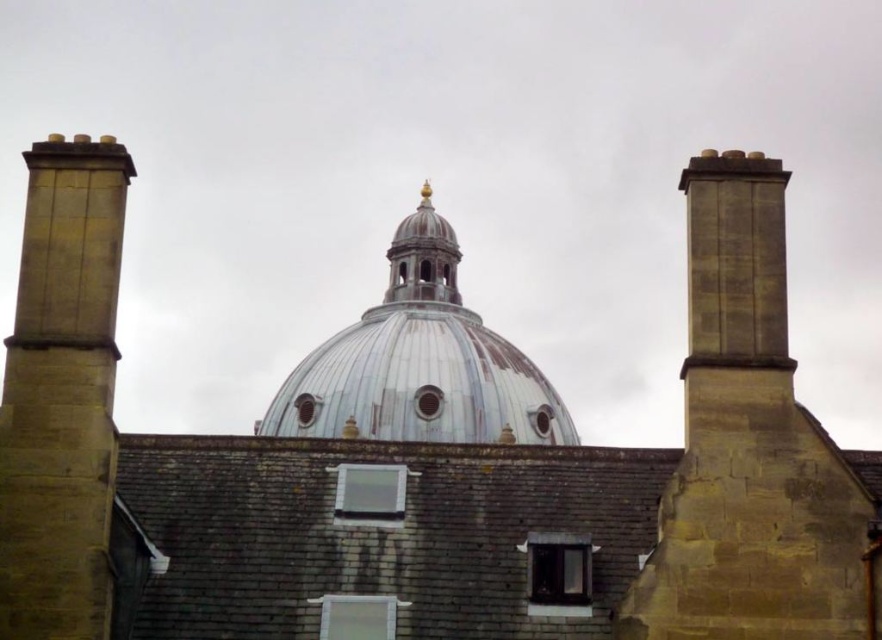
Question: Is brown stone chimney at left to the left of metallic silver dome at center from the viewer's perspective?

Choices:
 (A) yes
 (B) no

Answer: (A)

Question: Does brown stone chimney at left appear on the right side of metallic silver dome at center?

Choices:
 (A) yes
 (B) no

Answer: (B)

Question: Does brown stone chimney at left have a greater width compared to metallic silver dome at center?

Choices:
 (A) no
 (B) yes

Answer: (A)

Question: Which of the following is the farthest from the observer?

Choices:
 (A) brown stone chimney at left
 (B) metallic silver dome at center

Answer: (B)

Question: Which of the following is the closest to the observer?

Choices:
 (A) metallic silver dome at center
 (B) brown stone chimney at left

Answer: (B)

Question: Among these objects, which one is farthest from the camera?

Choices:
 (A) brown stone chimney at left
 (B) metallic silver dome at center

Answer: (B)